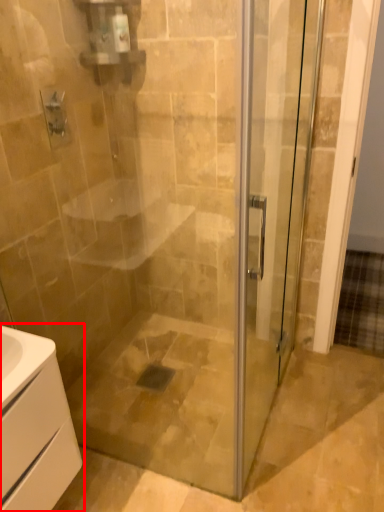
Question: From the image's perspective, where is bathroom cabinet (annotated by the red box) located in relation to screen door in the image?

Choices:
 (A) above
 (B) below

Answer: (B)